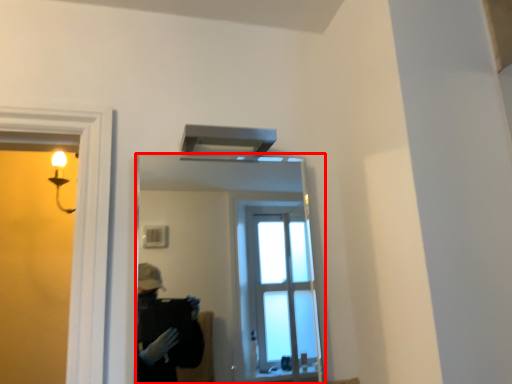
Question: From the image, what is the correct spatial relationship of mirror (annotated by the red box) in relation to exhaust hood?

Choices:
 (A) left
 (B) right

Answer: (B)